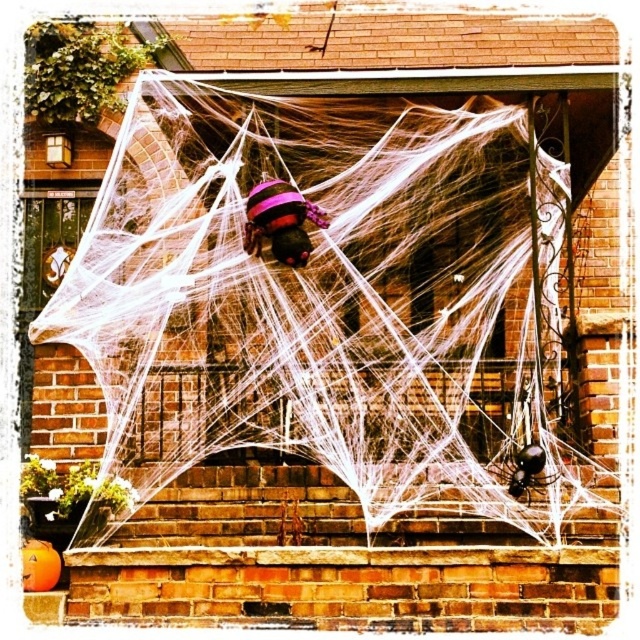
How far apart are white mesh spider web at center and black glossy spider at lower right?

96.73 centimeters

Is white mesh spider web at center positioned at the back of black glossy spider at lower right?

No, white mesh spider web at center is closer to the viewer.

The width and height of the screenshot is (640, 640). Identify the location of white mesh spider web at center. (x=330, y=300).

Between point (61, 305) and point (259, 232), which one is positioned behind?

Positioned behind is point (61, 305).

Does point (513, 129) come in front of point (288, 212)?

No, it is behind (288, 212).

Who is more distant from viewer, (106,280) or (310,202)?

The point (310,202) is more distant.

Identify the location of white mesh spider web at center. (330, 300).

Who is taller, purple fuzzy spider at center or black glossy spider at lower right?

With more height is purple fuzzy spider at center.

Image resolution: width=640 pixels, height=640 pixels. Find the location of `purple fuzzy spider at center`. purple fuzzy spider at center is located at coordinates (280, 221).

Find the location of a particular element. The image size is (640, 640). purple fuzzy spider at center is located at coordinates (280, 221).